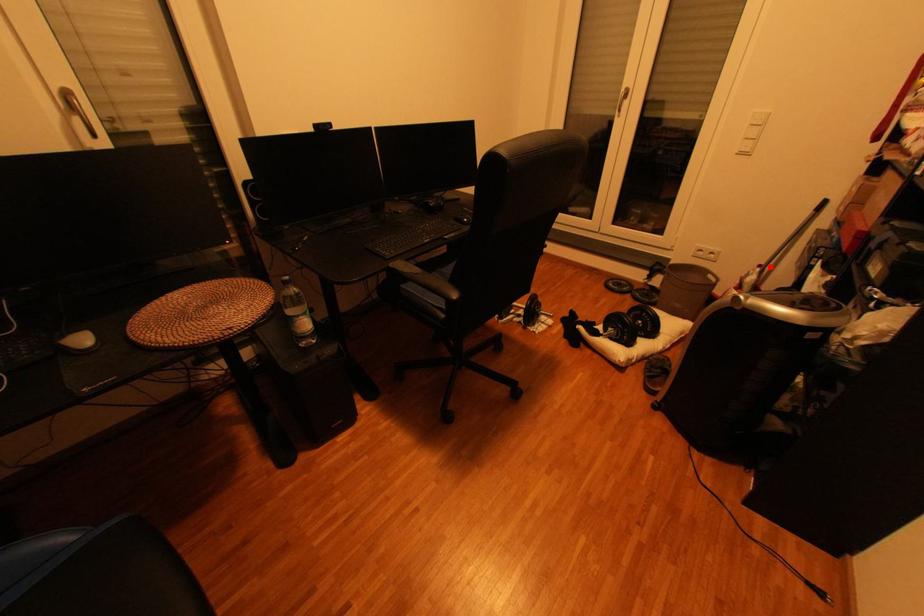
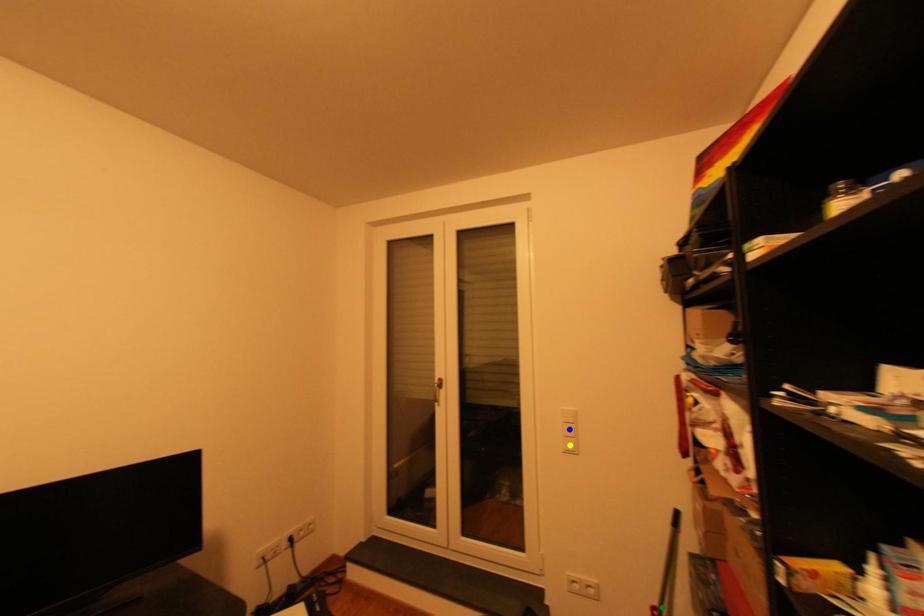
Question: I am providing you with two images of the same scene from different viewpoints. A red point is marked on the first image. You are given multiple points on the second image. Which mark in image 2 goes with the point in image 1?

Choices:
 (A) yellow point
 (B) green point
 (C) blue point

Answer: (B)